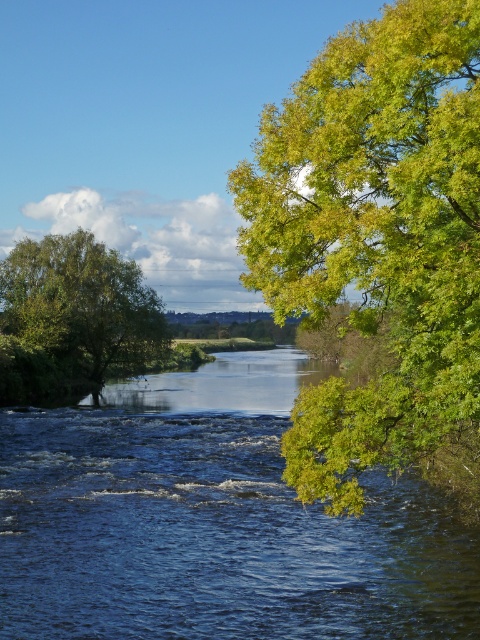
Who is positioned more to the right, blue water at center or green leafy tree at left?

Positioned to the right is blue water at center.

Which is above, blue water at center or green leafy tree at left?

green leafy tree at left

The image size is (480, 640). What do you see at coordinates (214, 522) in the screenshot?
I see `blue water at center` at bounding box center [214, 522].

Image resolution: width=480 pixels, height=640 pixels. Find the location of `blue water at center`. blue water at center is located at coordinates (214, 522).

Does blue water at center appear on the right side of green leafy tree at right?

No, blue water at center is not to the right of green leafy tree at right.

Between point (406, 556) and point (282, 204), which one is positioned behind?

The point (406, 556) is more distant.

Locate an element on the screen. The width and height of the screenshot is (480, 640). blue water at center is located at coordinates (214, 522).

Where is `blue water at center`? The image size is (480, 640). blue water at center is located at coordinates (214, 522).

Locate an element on the screen. The width and height of the screenshot is (480, 640). green leafy tree at right is located at coordinates (376, 241).

Between point (260, 132) and point (60, 346), which one is positioned behind?

Positioned behind is point (260, 132).

Is point (456, 314) behind point (15, 276)?

No, it is not.

This screenshot has height=640, width=480. I want to click on green leafy tree at right, so click(376, 241).